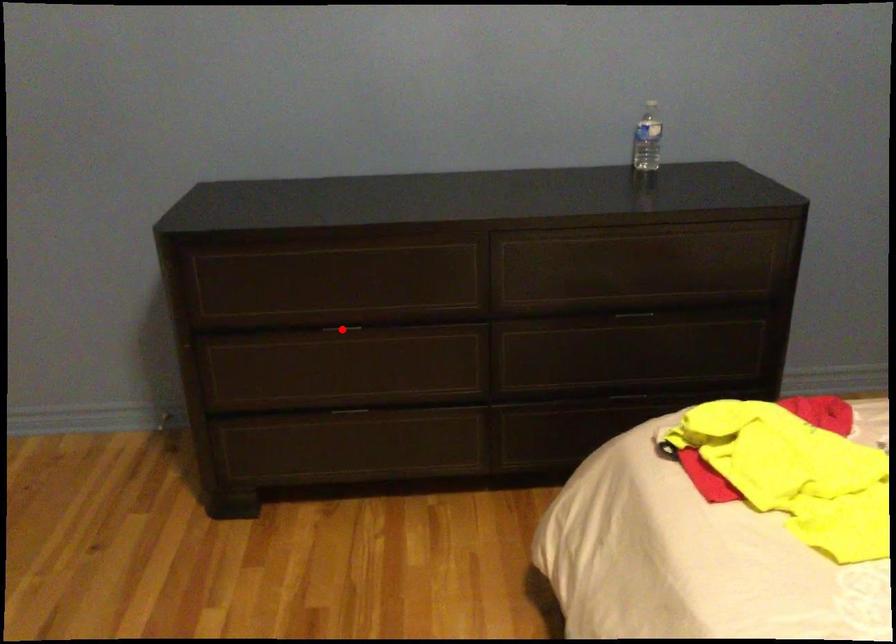
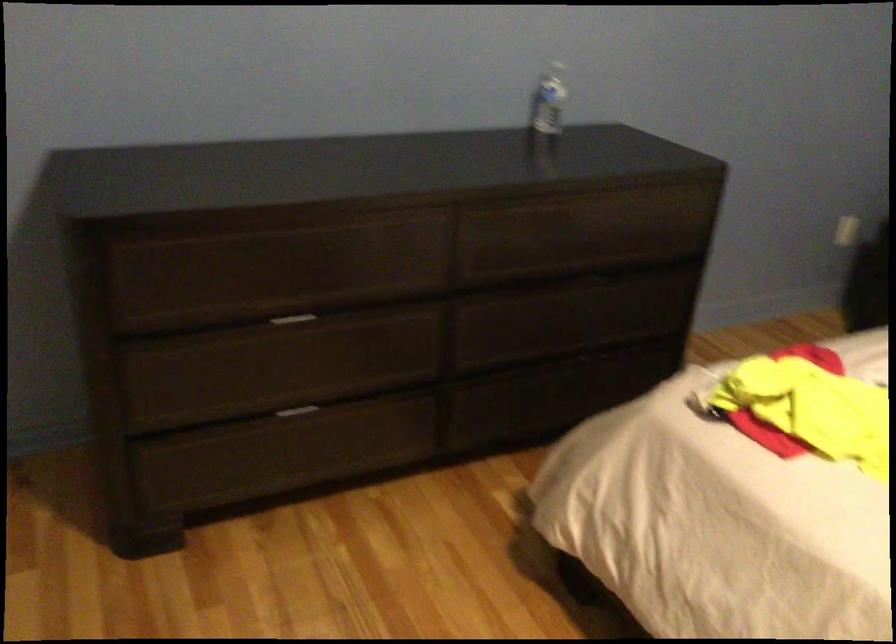
Find the pixel in the second image that matches the highlighted location in the first image.

(291, 319)